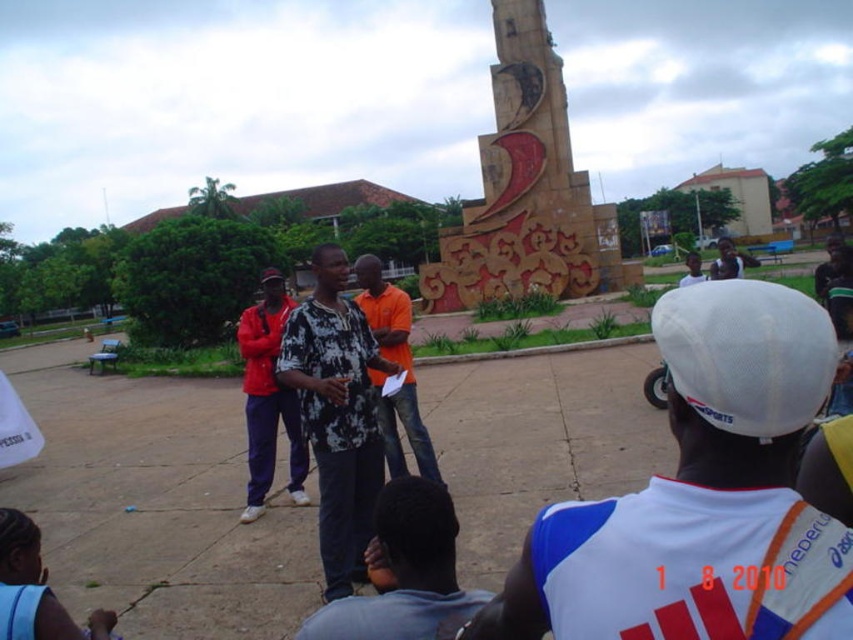
Question: Which of the following is the closest to the observer?

Choices:
 (A) white mesh cap at upper right
 (B) red fabric pants at center

Answer: (B)

Question: Is black printed shirt at center to the left of red fabric pants at center from the viewer's perspective?

Choices:
 (A) no
 (B) yes

Answer: (A)

Question: Estimate the real-world distances between objects in this image. Which object is farther from the white mesh cap at upper right?

Choices:
 (A) red fabric pants at center
 (B) orange cotton shirt at center
 (C) white mesh cap at center
 (D) dark blue shirt at center

Answer: (D)

Question: Is white mesh cap at center to the right of orange cotton shirt at center from the viewer's perspective?

Choices:
 (A) no
 (B) yes

Answer: (B)

Question: Where is white mesh cap at center located in relation to white mesh cap at upper right in the image?

Choices:
 (A) right
 (B) left

Answer: (B)

Question: Considering the real-world distances, which object is closest to the orange cotton shirt at center?

Choices:
 (A) red fabric pants at center
 (B) white mesh cap at center
 (C) dark blue shirt at center
 (D) white mesh cap at upper right

Answer: (A)